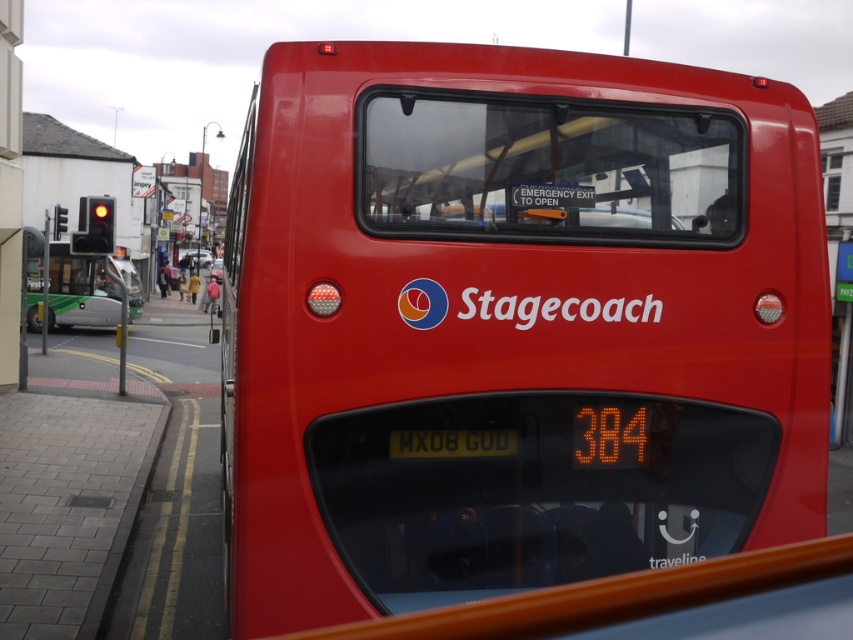
Can you confirm if shiny red bus at center is thinner than yellow metallic license plate at center?

Incorrect, shiny red bus at center's width is not less than yellow metallic license plate at center's.

Is shiny red bus at center smaller than yellow metallic license plate at center?

No, shiny red bus at center is not smaller than yellow metallic license plate at center.

Is point (431, 269) farther from camera compared to point (514, 435)?

That is False.

The height and width of the screenshot is (640, 853). What are the coordinates of `shiny red bus at center` in the screenshot? It's located at (514, 324).

This screenshot has height=640, width=853. I want to click on green metallic bus at left, so click(x=80, y=289).

Can you confirm if green metallic bus at left is wider than yellow metallic license plate at center?

Yes.

This screenshot has height=640, width=853. I want to click on green metallic bus at left, so click(x=80, y=289).

Between shiny red bus at center and green metallic bus at left, which one is positioned lower?

shiny red bus at center

Between point (825, 368) and point (94, 316), which one is positioned in front?

Positioned in front is point (825, 368).

Does point (381, 403) lie behind point (59, 244)?

No, (381, 403) is closer to viewer.

You are a GUI agent. You are given a task and a screenshot of the screen. Output one action in this format:
    pyautogui.click(x=<x>, y=<y>)
    Task: Click on the shiny red bus at center
    This screenshot has width=853, height=640.
    Given the screenshot: What is the action you would take?
    pyautogui.click(x=514, y=324)